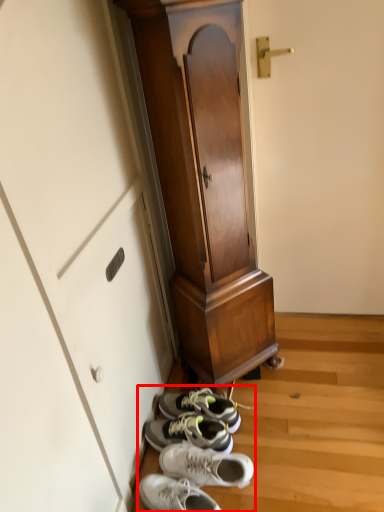
Question: In this image, where is shoe (annotated by the red box) located relative to furniture?

Choices:
 (A) left
 (B) right

Answer: (A)